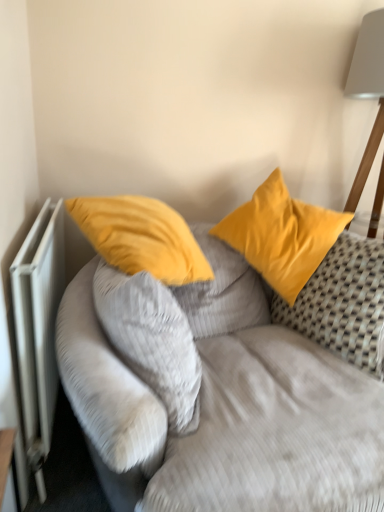
Question: From the image's perspective, is matte yellow pillow at center, which is the 1th pillow from left to right, above or below velvet yellow pillows at upper center?

Choices:
 (A) below
 (B) above

Answer: (B)

Question: Is point (155, 373) positioned closer to the camera than point (244, 454)?

Choices:
 (A) farther
 (B) closer

Answer: (A)

Question: Which of these objects is positioned farthest from the velvet yellow pillows at upper center?

Choices:
 (A) white metallic radiator at left
 (B) satin yellow pillow at upper right, which is the 1th pillow from right to left
 (C) matte yellow pillow at center, the second pillow when ordered from right to left

Answer: (A)

Question: Which of these objects is positioned farthest from the velvet yellow pillows at upper center?

Choices:
 (A) white metallic radiator at left
 (B) satin yellow pillow at upper right, which is the second pillow in left-to-right order
 (C) matte yellow pillow at center, the second pillow when ordered from right to left

Answer: (A)